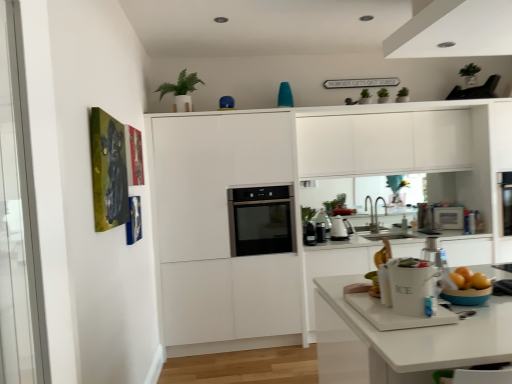
What do you see at coordinates (374, 213) in the screenshot? I see `silver metallic faucet at center` at bounding box center [374, 213].

Looking at this image, how much space does satin silver microwave at upper right, which appears as the 1th appliance when viewed from the right, occupy horizontally?

2.57 inches.

In order to click on satin silver microwave at upper right, the fourth appliance from the front in this screenshot , I will do `click(448, 218)`.

Where is `black matte coffee maker at center, the third appliance viewed from the right`? The image size is (512, 384). black matte coffee maker at center, the third appliance viewed from the right is located at coordinates (320, 232).

Describe the element at coordinates (261, 220) in the screenshot. I see `black glass oven at center` at that location.

Where is `white glossy kettle at center, arranged as the 2th appliance when viewed from the back`? white glossy kettle at center, arranged as the 2th appliance when viewed from the back is located at coordinates (340, 228).

At what (x,y) coordinates should I click in order to perform the action: click on silver metallic faucet at center. Please return your answer as a coordinate pair (x, y). Looking at the image, I should click on (374, 213).

Locate an element on the screen. This screenshot has height=384, width=512. the 4th appliance behind the green matte plant at upper center, starting your count from the anchor is located at coordinates (448, 218).

Choose the correct answer: Is satin silver microwave at upper right, the fourth appliance from the front, inside green matte plant at upper center or outside it?

The correct answer is: outside.

Considering the relative positions of satin silver microwave at upper right, which is the first appliance in back-to-front order, and green matte plant at upper center in the image provided, is satin silver microwave at upper right, which is the first appliance in back-to-front order, to the left or to the right of green matte plant at upper center?

Based on their positions, satin silver microwave at upper right, which is the first appliance in back-to-front order, is located to the right of green matte plant at upper center.

Is satin silver microwave at upper right, the fourth appliance when ordered from left to right, oriented away from green matte plant at upper center?

No, green matte plant at upper center is not at the back of satin silver microwave at upper right, the fourth appliance when ordered from left to right.

Between black plastic coffee maker at center, placed as the fourth appliance when sorted from back to front, and white ceramic ice bucket at lower center, which one is positioned in front?

white ceramic ice bucket at lower center is in front.

The height and width of the screenshot is (384, 512). In order to click on appliance that is the 1st one when counting backward from the white ceramic ice bucket at lower center in this screenshot , I will do `click(310, 234)`.

From the image's perspective, is black plastic coffee maker at center, placed as the fourth appliance when sorted from back to front, on white ceramic ice bucket at lower center?

No, from the image's perspective, black plastic coffee maker at center, placed as the fourth appliance when sorted from back to front, is not over white ceramic ice bucket at lower center.

In the scene shown: Considering the relative positions of satin silver microwave at upper right, which is the first appliance in back-to-front order, and white glossy kettle at center, which ranks as the third appliance in left-to-right order, in the image provided, is satin silver microwave at upper right, which is the first appliance in back-to-front order, in front of white glossy kettle at center, which ranks as the third appliance in left-to-right order,?

No, it is behind white glossy kettle at center, which ranks as the third appliance in left-to-right order.

Locate an element on the screen. Image resolution: width=512 pixels, height=384 pixels. the 1st appliance directly beneath the white glossy kettle at center, arranged as the 2th appliance when viewed from the back (from a real-world perspective) is located at coordinates (448, 218).

Considering the relative positions of satin silver microwave at upper right, the fourth appliance when ordered from left to right, and white glossy kettle at center, which ranks as the third appliance in left-to-right order, in the image provided, is satin silver microwave at upper right, the fourth appliance when ordered from left to right, to the left of white glossy kettle at center, which ranks as the third appliance in left-to-right order, from the viewer's perspective?

No, satin silver microwave at upper right, the fourth appliance when ordered from left to right, is not to the left of white glossy kettle at center, which ranks as the third appliance in left-to-right order.

From a real-world perspective, relative to white glossy kettle at center, arranged as the 3th appliance when viewed from the front, is satin silver microwave at upper right, which is the first appliance in back-to-front order, vertically above or below?

satin silver microwave at upper right, which is the first appliance in back-to-front order, is situated lower than white glossy kettle at center, arranged as the 3th appliance when viewed from the front, in the real world.

From the image's perspective, is black glass oven at center on green matte plant at upper center?

No, from the image's perspective, black glass oven at center is not over green matte plant at upper center.

How different are the orientations of black glass oven at center and green matte plant at upper center in degrees?

They differ by 3.03 degrees in their facing directions.

Does black glass oven at center lie behind green matte plant at upper center?

Yes, the depth of black glass oven at center is greater than that of green matte plant at upper center.

Which of these two, black glass oven at center or green matte plant at upper center, is smaller?

Smaller between the two is green matte plant at upper center.

Considering the sizes of objects white ceramic ice bucket at lower center and black matte coffee maker at center, the 3th appliance positioned from the back, in the image provided, who is wider, white ceramic ice bucket at lower center or black matte coffee maker at center, the 3th appliance positioned from the back,?

Wider between the two is white ceramic ice bucket at lower center.

Is white ceramic ice bucket at lower center not near black matte coffee maker at center, the third appliance viewed from the right?

Indeed, white ceramic ice bucket at lower center is not near black matte coffee maker at center, the third appliance viewed from the right.

Is white ceramic ice bucket at lower center taller than black matte coffee maker at center, the third appliance viewed from the right?

Yes, white ceramic ice bucket at lower center is taller than black matte coffee maker at center, the third appliance viewed from the right.

From a real-world perspective, is black plastic coffee maker at center, acting as the 4th appliance starting from the right, physically located above or below black glass oven at center?

black plastic coffee maker at center, acting as the 4th appliance starting from the right, is below black glass oven at center.

Considering the positions of objects black plastic coffee maker at center, which is the 1th appliance from left to right, and black glass oven at center in the image provided, who is behind, black plastic coffee maker at center, which is the 1th appliance from left to right, or black glass oven at center?

black plastic coffee maker at center, which is the 1th appliance from left to right.

From the image's perspective, is black plastic coffee maker at center, which is the 1th appliance from left to right, above or below black glass oven at center?

Clearly, from the image's perspective, black plastic coffee maker at center, which is the 1th appliance from left to right, is below black glass oven at center.

What's the angular difference between black plastic coffee maker at center, the first appliance from the front, and black glass oven at center's facing directions?

The facing directions of black plastic coffee maker at center, the first appliance from the front, and black glass oven at center are 0.765 degrees apart.

Considering the positions of point (172, 88) and point (371, 216), is point (172, 88) closer or farther from the camera than point (371, 216)?

Point (172, 88).

Could silver metallic faucet at center be considered to be inside green matte plant at upper center?

No, silver metallic faucet at center is not inside green matte plant at upper center.

Looking at this image, does green matte plant at upper center have a lesser width compared to silver metallic faucet at center?

No, green matte plant at upper center is not thinner than silver metallic faucet at center.

From a real-world perspective, who is located higher, green matte plant at upper center or silver metallic faucet at center?

green matte plant at upper center.

You are a GUI agent. You are given a task and a screenshot of the screen. Output one action in this format:
    pyautogui.click(x=<x>, y=<y>)
    Task: Click on the 4th appliance counting from the right of the green matte plant at upper center
    
    Given the screenshot: What is the action you would take?
    pyautogui.click(x=448, y=218)

From the image's perspective, count 2nd appliances downward from the white ceramic ice bucket at lower center and point to it. Please provide its 2D coordinates.

[(310, 234)]

Which object lies further to the anchor point black glass oven at center, white ceramic ice bucket at lower center or satin silver microwave at upper right, the fourth appliance from the front?

Among the two, white ceramic ice bucket at lower center is located further to black glass oven at center.

Consider the image. From the image, which object appears to be nearer to satin silver microwave at upper right, which appears as the 1th appliance when viewed from the right, black matte coffee maker at center, the 3th appliance positioned from the back, or black glass oven at center?

black matte coffee maker at center, the 3th appliance positioned from the back.

Estimate the real-world distances between objects in this image. Which object is further from white ceramic ice bucket at lower center, black plastic coffee maker at center, which is the 1th appliance from left to right, or silver metallic faucet at center?

silver metallic faucet at center is further to white ceramic ice bucket at lower center.

Based on their spatial positions, is black matte coffee maker at center, arranged as the 2th appliance when viewed from the front, or satin silver microwave at upper right, which appears as the 1th appliance when viewed from the right, closer to silver metallic faucet at center?

satin silver microwave at upper right, which appears as the 1th appliance when viewed from the right, is positioned closer to the anchor silver metallic faucet at center.

Estimate the real-world distances between objects in this image. Which object is further from silver metallic faucet at center, satin silver microwave at upper right, the fourth appliance from the front, or black plastic coffee maker at center, acting as the 4th appliance starting from the right?

black plastic coffee maker at center, acting as the 4th appliance starting from the right.

Considering their positions, is black glass oven at center positioned closer to black plastic coffee maker at center, acting as the 4th appliance starting from the right, than silver metallic faucet at center?

black glass oven at center is closer to black plastic coffee maker at center, acting as the 4th appliance starting from the right.

Looking at the image, which one is located closer to black plastic coffee maker at center, the first appliance from the front, white ceramic ice bucket at lower center or silver metallic faucet at center?

Among the two, silver metallic faucet at center is located nearer to black plastic coffee maker at center, the first appliance from the front.

Considering their positions, is white ceramic ice bucket at lower center positioned further to black plastic coffee maker at center, the first appliance from the front, than satin silver microwave at upper right, the fourth appliance from the front?

white ceramic ice bucket at lower center lies further to black plastic coffee maker at center, the first appliance from the front, than the other object.

Where is `plant located between white ceramic ice bucket at lower center and black matte coffee maker at center, the third appliance viewed from the right, in the depth direction`? plant located between white ceramic ice bucket at lower center and black matte coffee maker at center, the third appliance viewed from the right, in the depth direction is located at coordinates (180, 85).

The image size is (512, 384). In order to click on appliance situated between black glass oven at center and black matte coffee maker at center, the third appliance viewed from the right, from left to right in this screenshot , I will do `click(310, 234)`.

The image size is (512, 384). Find the location of `home appliance positioned between white ceramic ice bucket at lower center and satin silver microwave at upper right, which is the first appliance in back-to-front order, from near to far`. home appliance positioned between white ceramic ice bucket at lower center and satin silver microwave at upper right, which is the first appliance in back-to-front order, from near to far is located at coordinates (261, 220).

Identify the location of home appliance positioned between white ceramic ice bucket at lower center and black matte coffee maker at center, the 3th appliance positioned from the back, from near to far. (261, 220).